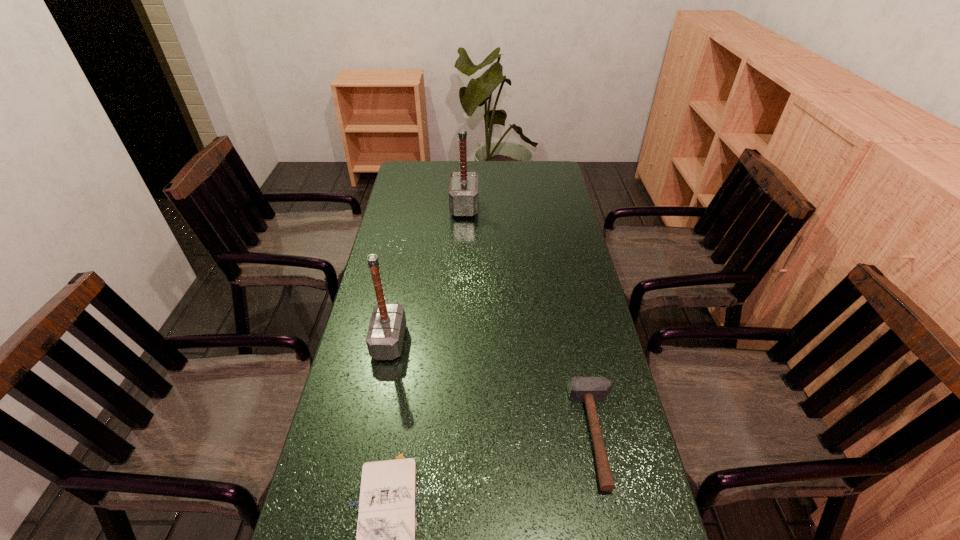
At what (x,y) coordinates should I click in order to perform the action: click on the second object from right to left. Please return your answer as a coordinate pair (x, y). Looking at the image, I should click on (463, 188).

Locate an element on the screen. the second hammer from right to left is located at coordinates (463, 188).

This screenshot has width=960, height=540. I want to click on the second farthest object, so click(385, 336).

You are a GUI agent. You are given a task and a screenshot of the screen. Output one action in this format:
    pyautogui.click(x=<x>, y=<y>)
    Task: Click on the second nearest hammer
    The height and width of the screenshot is (540, 960).
    Given the screenshot: What is the action you would take?
    pyautogui.click(x=385, y=336)

This screenshot has height=540, width=960. I want to click on the rightmost hammer, so click(x=580, y=389).

Image resolution: width=960 pixels, height=540 pixels. Find the location of `the nearest hammer`. the nearest hammer is located at coordinates (580, 389).

Locate an element on the screen. This screenshot has height=540, width=960. vacant space located on the left of the third object from left to right is located at coordinates (409, 207).

This screenshot has width=960, height=540. Identify the location of vacant region located on the striking surface of the leftmost hammer. (491, 341).

Image resolution: width=960 pixels, height=540 pixels. What are the coordinates of `blank space located on the striking surface of the second shortest object` in the screenshot? It's located at (443, 435).

Locate an element on the screen. free space located 0.110m on the striking surface of the second shortest object is located at coordinates (529, 435).